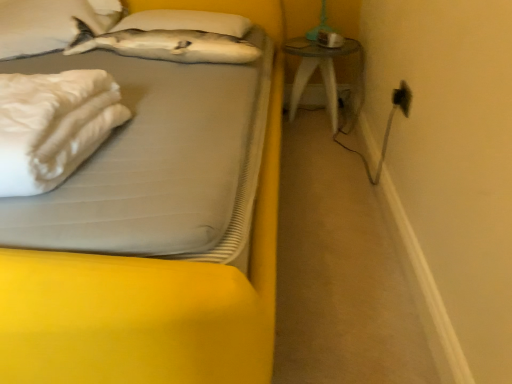
Question: Considering the relative positions of white soft pillow at upper center, marked as the 1th pillow in a right-to-left arrangement, and transparent glass table at right in the image provided, is white soft pillow at upper center, marked as the 1th pillow in a right-to-left arrangement, to the left or to the right of transparent glass table at right?

Choices:
 (A) left
 (B) right

Answer: (A)

Question: In terms of size, does white soft pillow at upper center, which is the second pillow from left to right, appear bigger or smaller than transparent glass table at right?

Choices:
 (A) big
 (B) small

Answer: (B)

Question: Considering the real-world distances, which object is farthest from the white soft pillow at upper center, marked as the 1th pillow in a right-to-left arrangement?

Choices:
 (A) white matte pillow at upper left, marked as the 1th pillow in a left-to-right arrangement
 (B) black plastic electric outlet at upper right
 (C) white soft bed at upper left
 (D) transparent glass table at right
 (E) white soft fabric at left

Answer: (C)

Question: Considering the real-world distances, which object is farthest from the black plastic electric outlet at upper right?

Choices:
 (A) white soft pillow at upper center, marked as the 1th pillow in a right-to-left arrangement
 (B) white soft fabric at left
 (C) white soft bed at upper left
 (D) white matte pillow at upper left, marked as the 1th pillow in a left-to-right arrangement
 (E) transparent glass table at right

Answer: (D)